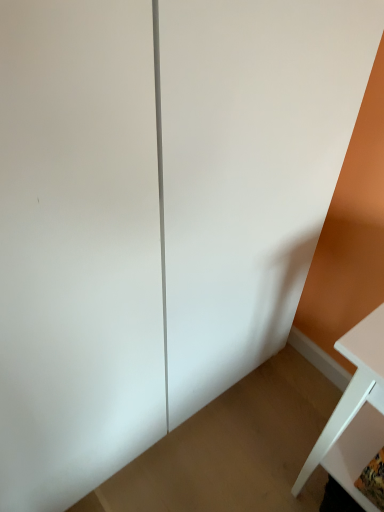
Based on the photo, measure the distance between point (x=372, y=356) and camera.

Point (x=372, y=356) and camera are 28.03 inches apart from each other.

Where is `white matte table at lower right`? This screenshot has width=384, height=512. white matte table at lower right is located at coordinates (354, 412).

What do you see at coordinates (354, 412) in the screenshot? The width and height of the screenshot is (384, 512). I see `white matte table at lower right` at bounding box center [354, 412].

You are a GUI agent. You are given a task and a screenshot of the screen. Output one action in this format:
    pyautogui.click(x=<x>, y=<y>)
    Task: Click on the white matte table at lower right
    The image size is (384, 512).
    Given the screenshot: What is the action you would take?
    pyautogui.click(x=354, y=412)